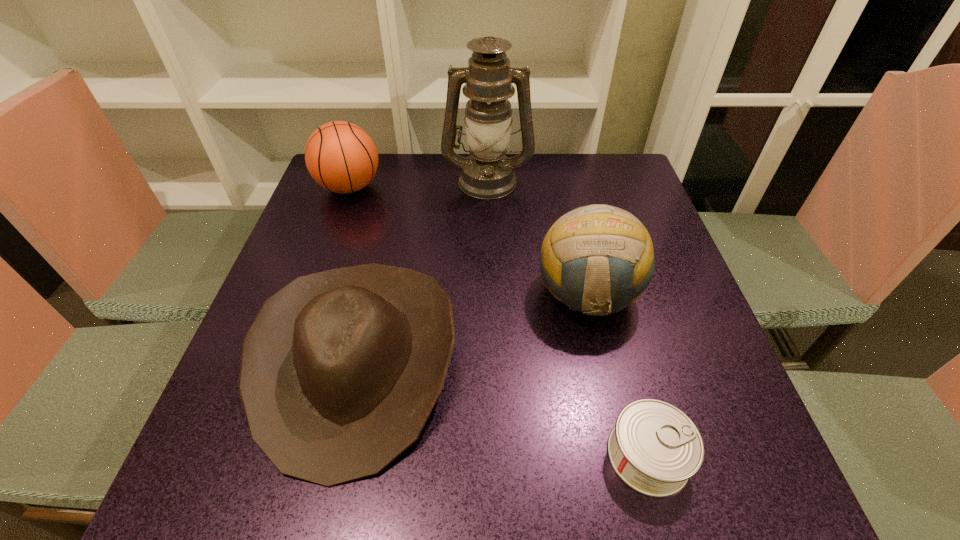
You are a GUI agent. You are given a task and a screenshot of the screen. Output one action in this format:
    pyautogui.click(x=<x>, y=<y>)
    Task: Click on the free point that satisfies the following two spatial constraints: 1. on the front side of the basketball; 2. on the right side of the can
    The width and height of the screenshot is (960, 540).
    Given the screenshot: What is the action you would take?
    pyautogui.click(x=254, y=455)

Where is `vacant point that satisfies the following two spatial constraints: 1. on the front side of the volleyball; 2. on the right side of the shortest object`? vacant point that satisfies the following two spatial constraints: 1. on the front side of the volleyball; 2. on the right side of the shortest object is located at coordinates (624, 455).

The image size is (960, 540). In order to click on free region that satisfies the following two spatial constraints: 1. on the front side of the cowboy hat; 2. on the right side of the basketball in this screenshot , I will do `click(288, 362)`.

The image size is (960, 540). In order to click on blank space that satisfies the following two spatial constraints: 1. on the back side of the fourth tallest object; 2. on the right side of the tallest object in this screenshot , I will do `click(398, 180)`.